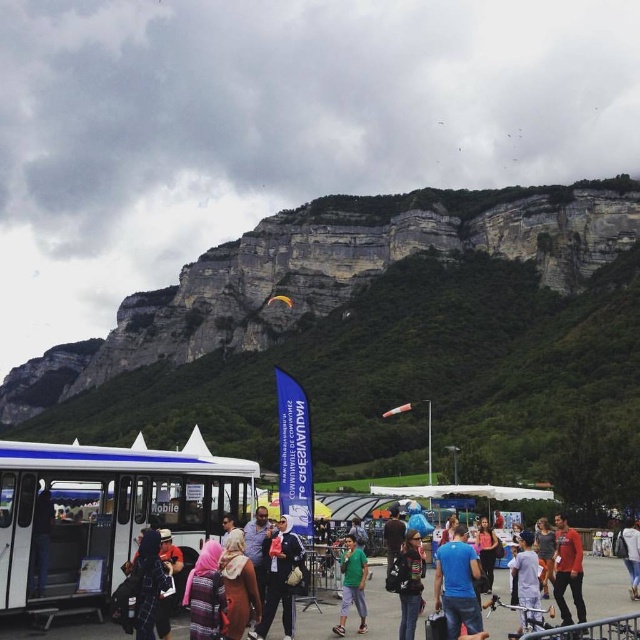
Question: Which of the following is the closest to the observer?

Choices:
 (A) green matte shirt at center
 (B) matte gray hoodie at center
 (C) white cotton shirt at lower right
 (D) black leather jacket at center

Answer: (D)

Question: Can you confirm if white plastic food truck at center is positioned below yellow fabric kite at center?

Choices:
 (A) yes
 (B) no

Answer: (A)

Question: Observing the image, what is the correct spatial positioning of striped fabric headscarf at center in reference to matte pink shirt at center?

Choices:
 (A) above
 (B) below

Answer: (A)

Question: Does red matte jacket at center have a lesser width compared to blue fabric umbrella at center?

Choices:
 (A) yes
 (B) no

Answer: (B)

Question: Which point appears closest to the camera in this image?

Choices:
 (A) (536, 580)
 (B) (497, 432)
 (C) (570, 548)

Answer: (A)

Question: Which object is positioned closest to the dark brown leather jacket at center?

Choices:
 (A) red matte jacket at center
 (B) yellow fabric kite at center
 (C) green matte shirt at center

Answer: (C)